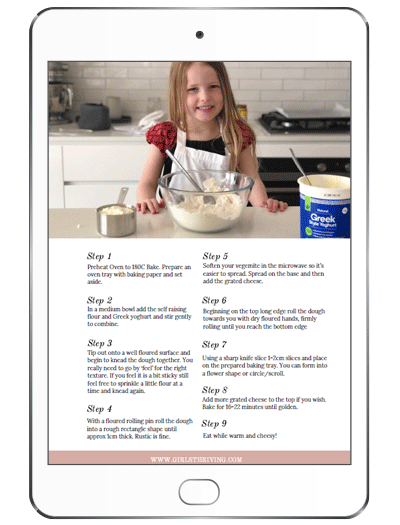
In order to click on measuring cup handle in this screenshot , I will do `click(123, 197)`.